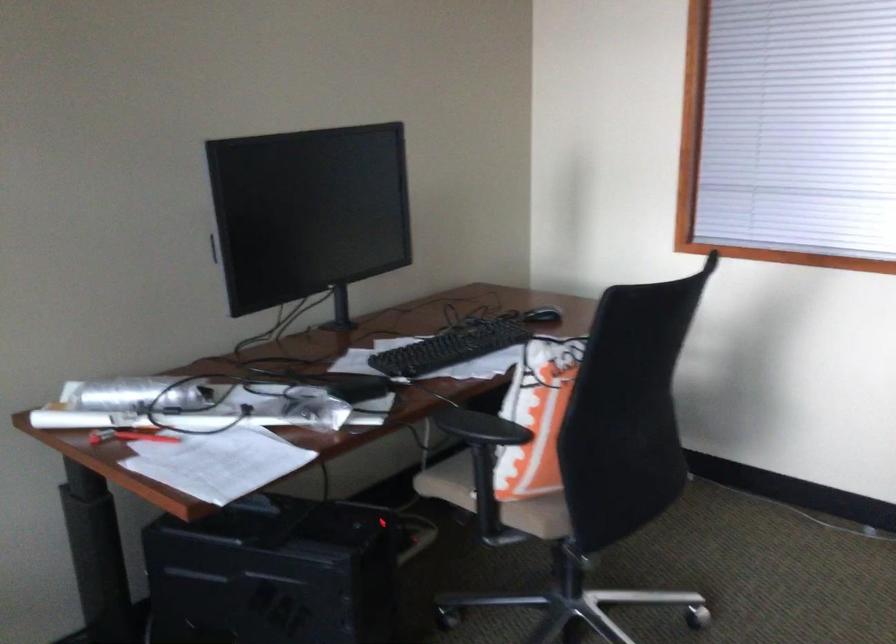
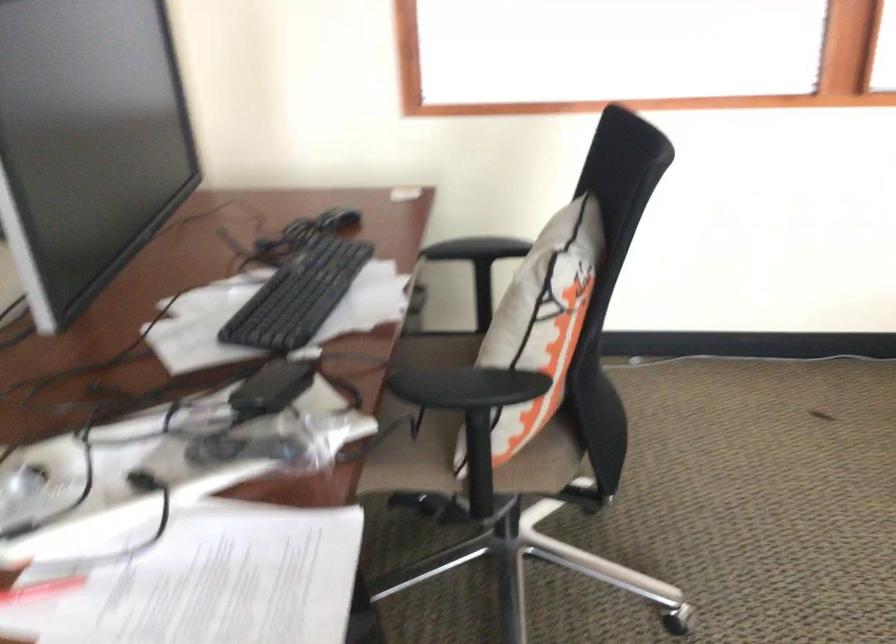
Question: The first image is from the beginning of the video and the second image is from the end. How did the camera likely rotate when shooting the video?

Choices:
 (A) Left
 (B) Right
 (C) Up
 (D) Down

Answer: (B)